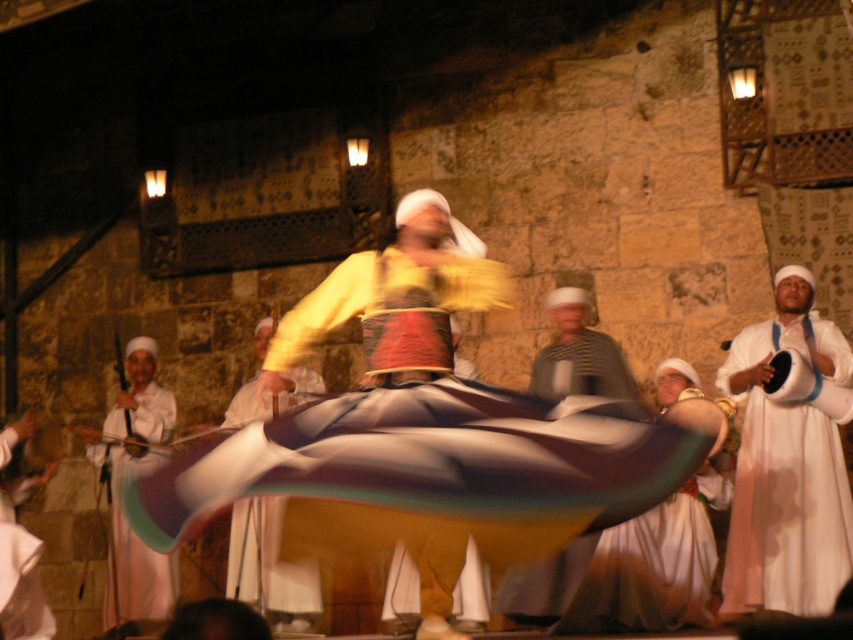
Question: Which is farther from the white cotton robe at right?

Choices:
 (A) white cotton dress at lower left
 (B) striped fabric headscarf at center
 (C) white cotton robe at left
 (D) white cotton dress at center

Answer: (A)

Question: Considering the relative positions of white cotton robe at right and striped fabric headscarf at center in the image provided, where is white cotton robe at right located with respect to striped fabric headscarf at center?

Choices:
 (A) left
 (B) right

Answer: (B)

Question: Which point is farther to the camera?

Choices:
 (A) white cotton robe at right
 (B) striped fabric headscarf at center

Answer: (B)

Question: Does white cotton dress at center have a greater width compared to white cotton dress at lower left?

Choices:
 (A) yes
 (B) no

Answer: (A)

Question: Is white cotton robe at left closer to camera compared to striped fabric headscarf at center?

Choices:
 (A) yes
 (B) no

Answer: (B)

Question: Which object appears farthest from the camera in this image?

Choices:
 (A) white cotton robe at right
 (B) white cotton dress at lower left

Answer: (A)